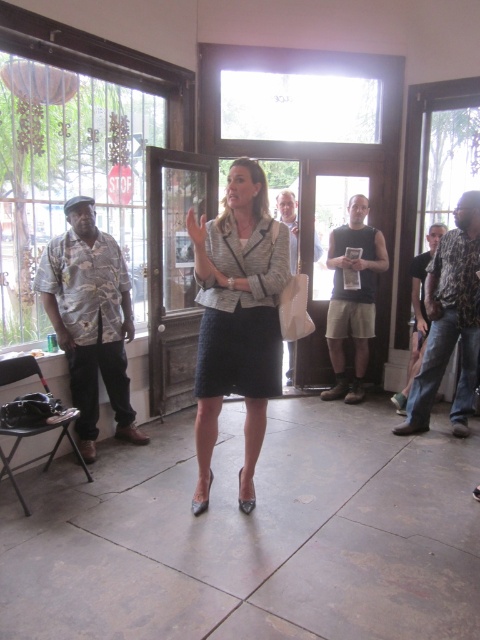
Which is in front, point (132, 337) or point (423, 330)?

Point (132, 337) is in front.

Can you confirm if camouflage shirt at left is positioned to the left of camouflage shirt at right?

Correct, you'll find camouflage shirt at left to the left of camouflage shirt at right.

Does point (120, 362) come farther from viewer compared to point (408, 378)?

No, it is not.

Locate an element on the screen. This screenshot has height=640, width=480. camouflage shirt at left is located at coordinates (91, 320).

Between camouflage shirt at left and black textured skirt at center, which one is positioned lower?

Positioned lower is black textured skirt at center.

Is camouflage shirt at left to the right of black textured skirt at center from the viewer's perspective?

In fact, camouflage shirt at left is to the left of black textured skirt at center.

Locate an element on the screen. This screenshot has height=640, width=480. camouflage shirt at left is located at coordinates (91, 320).

At what (x,y) coordinates should I click in order to perform the action: click on camouflage shirt at left. Please return your answer as a coordinate pair (x, y). This screenshot has height=640, width=480. Looking at the image, I should click on (91, 320).

Is textured gray blazer at center taller than black textured skirt at center?

Yes, textured gray blazer at center is taller than black textured skirt at center.

Is textured gray blazer at center smaller than black textured skirt at center?

No, textured gray blazer at center is not smaller than black textured skirt at center.

This screenshot has height=640, width=480. Find the location of `textured gray blazer at center`. textured gray blazer at center is located at coordinates (238, 320).

In order to click on textured gray blazer at center in this screenshot , I will do `click(238, 320)`.